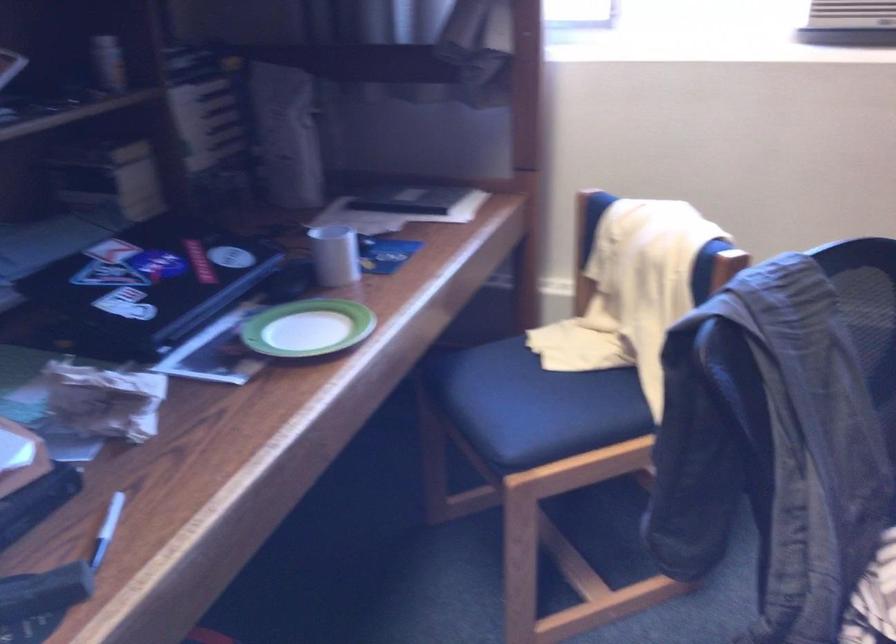
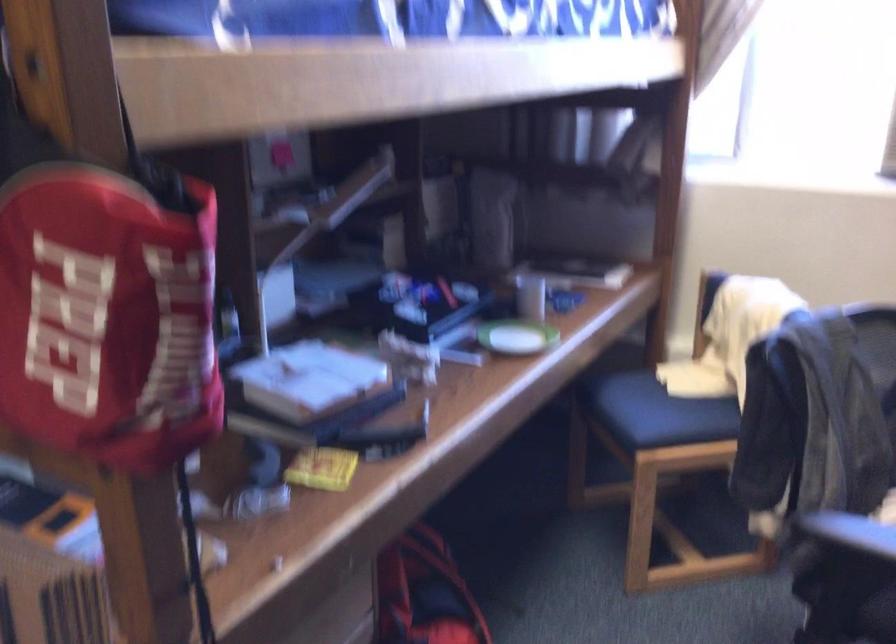
Question: I am providing you with two images of the same scene from different viewpoints. Please identify which objects are invisible in image2.

Choices:
 (A) white ceramic cup
 (B) small green saucer
 (C) black chair armrest
 (D) striped beach ball

Answer: (C)